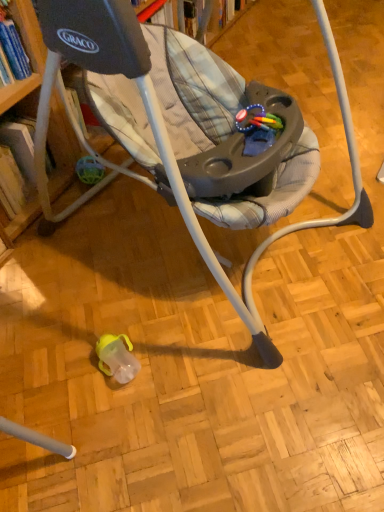
Question: Based on their sizes in the image, would you say hardcover book at left is bigger or smaller than rubberized plastic teething ring at center?

Choices:
 (A) big
 (B) small

Answer: (A)

Question: Considering the positions of hardcover book at left and rubberized plastic teething ring at center in the image, is hardcover book at left taller or shorter than rubberized plastic teething ring at center?

Choices:
 (A) short
 (B) tall

Answer: (B)

Question: Considering the real-world distances, which object is farthest from the rubberized plastic teething ring at center?

Choices:
 (A) matte gray baby swing at center
 (B) hardcover book at left

Answer: (B)

Question: Which object is positioned farthest from the matte gray baby swing at center?

Choices:
 (A) rubberized plastic teething ring at center
 (B) hardcover book at left

Answer: (B)